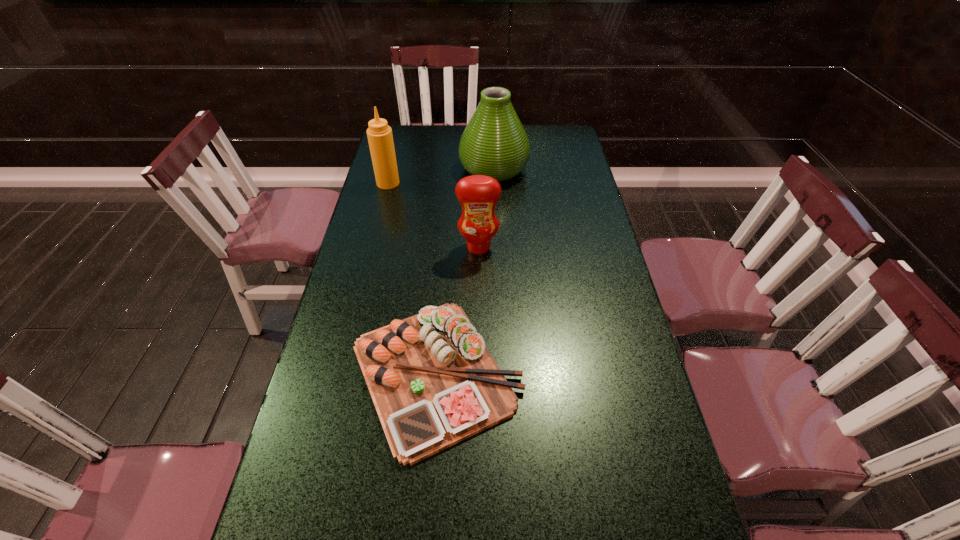
Locate an element on the screen. The width and height of the screenshot is (960, 540). vase is located at coordinates (494, 143).

Locate an element on the screen. This screenshot has height=540, width=960. the farther condiment is located at coordinates (380, 138).

Locate an element on the screen. the right condiment is located at coordinates (478, 194).

The height and width of the screenshot is (540, 960). What are the coordinates of `the nearer condiment` in the screenshot? It's located at (478, 194).

The width and height of the screenshot is (960, 540). In order to click on the nearest object in this screenshot , I will do `click(433, 382)`.

I want to click on platter, so click(x=433, y=382).

At what (x,y) coordinates should I click in order to perform the action: click on free space located on the left of the vase. Please return your answer as a coordinate pair (x, y). This screenshot has height=540, width=960. Looking at the image, I should click on point(397,169).

You are a GUI agent. You are given a task and a screenshot of the screen. Output one action in this format:
    pyautogui.click(x=<x>, y=<y>)
    Task: Click on the vacant space positioned 0.080m on the right of the farther condiment
    This screenshot has height=540, width=960.
    Given the screenshot: What is the action you would take?
    pyautogui.click(x=421, y=183)

Find the location of `vacant region located 0.350m on the label side of the shorter condiment`. vacant region located 0.350m on the label side of the shorter condiment is located at coordinates tap(478, 351).

The width and height of the screenshot is (960, 540). In order to click on free spot located 0.280m on the right of the shortest object in this screenshot , I will do `click(639, 374)`.